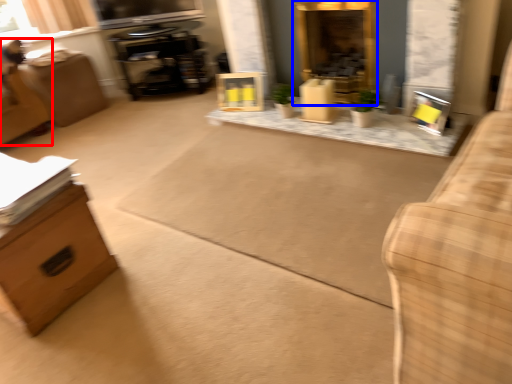
Question: Which object appears closest to the camera in this image, swivel chair (highlighted by a red box) or fireplace (highlighted by a blue box)?

Choices:
 (A) swivel chair
 (B) fireplace

Answer: (B)